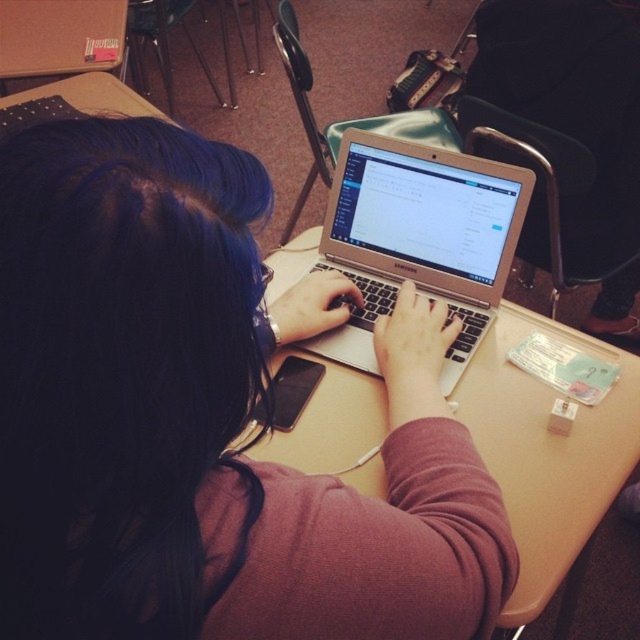
You need to place a large textbook on the desk without covering the matte silver laptop at center. Given their sizes, will the beige wood table at center have enough space for both the textbook and the laptop?

The matte silver laptop at center is smaller than the beige wood table at center, so there should be enough space on the beige wood table at center to place both the laptop and the textbook without overlapping.

Consider the image. You need to place a rectangular box that is 1.2 meters wide on the desk. Based on the information provided, will the matte silver laptop at center and the beige wood table at center allow enough space for the box?

The matte silver laptop at center has a lesser width compared to beige wood table at center. Since the laptop is narrower than the table, the table might have sufficient space for the 1.2m box, but the laptop itself is too narrow. However, the question mentions placing the box on the desk, which is the table. The table is wider than the laptop, so if the box is placed on the table away from the laptop, it might fit. But the exact dimensions of the table aren

Based on the photo, you are a student trying to locate your matte silver laptop at center on the desk. The coordinates provided are point (205, 419). Can you confirm if this point accurately represents the location of your matte silver laptop at center?

Yes, according to the description, point (205, 419) corresponds to the matte silver laptop at center, so this point accurately represents its location.